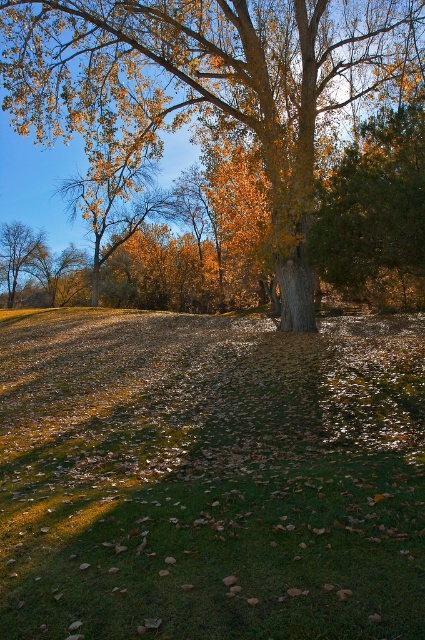
Question: Among these points, which one is nearest to the camera?

Choices:
 (A) (76, 397)
 (B) (255, 84)

Answer: (A)

Question: Which is farther from the green grass at center?

Choices:
 (A) smooth brown tree trunk at left
 (B) golden textured tree at center

Answer: (A)

Question: In this image, where is golden textured tree at center located relative to smooth brown tree trunk at left?

Choices:
 (A) right
 (B) left

Answer: (A)

Question: Does golden textured tree at center have a lesser width compared to smooth brown tree trunk at left?

Choices:
 (A) yes
 (B) no

Answer: (B)

Question: Does golden textured tree at center have a greater width compared to smooth brown tree trunk at left?

Choices:
 (A) no
 (B) yes

Answer: (B)

Question: Which point is closer to the camera?

Choices:
 (A) golden textured tree at center
 (B) green grass at center

Answer: (B)